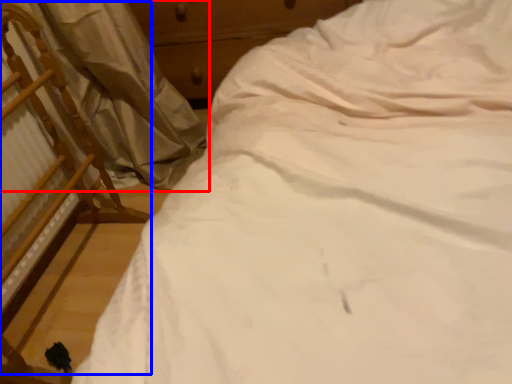
Question: Among these objects, which one is nearest to the camera, curtain (highlighted by a red box) or chair (highlighted by a blue box)?

Choices:
 (A) curtain
 (B) chair

Answer: (B)